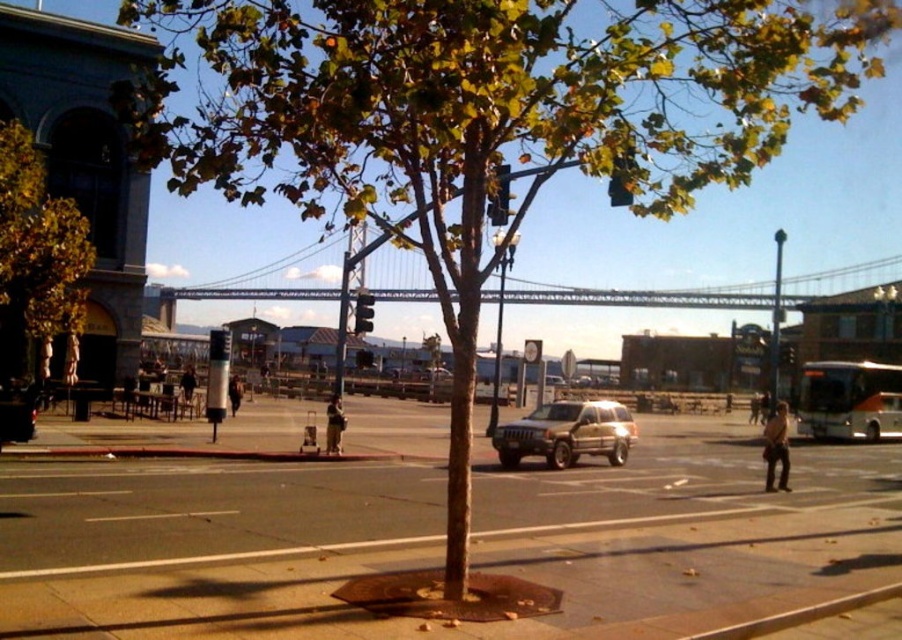
Question: Which point is farther to the camera?

Choices:
 (A) (503, 445)
 (B) (551, 515)

Answer: (A)

Question: Can you confirm if green leafy tree at left is positioned to the right of metallic gray suspension bridge at center?

Choices:
 (A) no
 (B) yes

Answer: (A)

Question: Does brown asphalt pavement at center appear under gold metallic suv at center?

Choices:
 (A) no
 (B) yes

Answer: (B)

Question: Which point is farther to the camera?

Choices:
 (A) green leafy tree at left
 (B) gold metallic suv at center
 (C) brown asphalt pavement at center

Answer: (A)

Question: Does brown asphalt pavement at center appear on the left side of gold metallic suv at center?

Choices:
 (A) yes
 (B) no

Answer: (A)

Question: Which object is the farthest from the metallic gray suspension bridge at center?

Choices:
 (A) brown asphalt pavement at center
 (B) gold metallic suv at center
 (C) green leafy tree at left

Answer: (B)